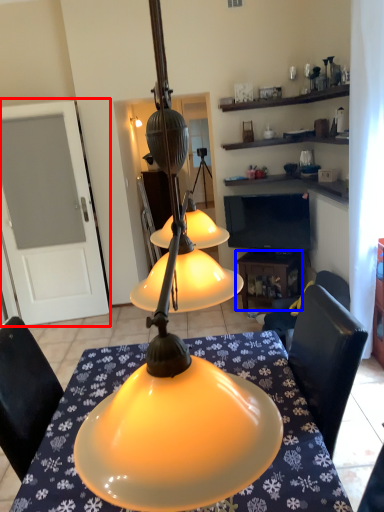
Question: Which point is closer to the camera, glass door (highlighted by a red box) or table (highlighted by a blue box)?

Choices:
 (A) glass door
 (B) table

Answer: (A)